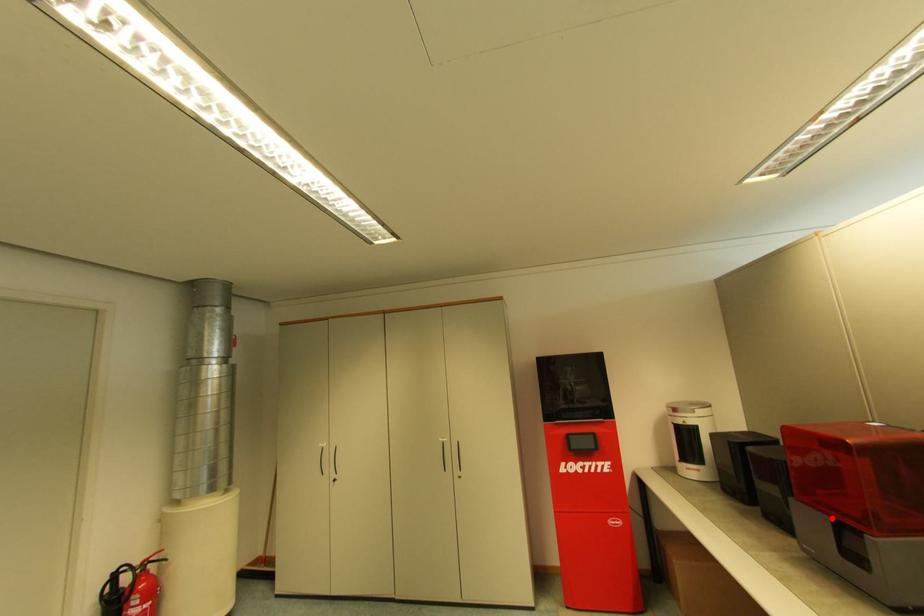
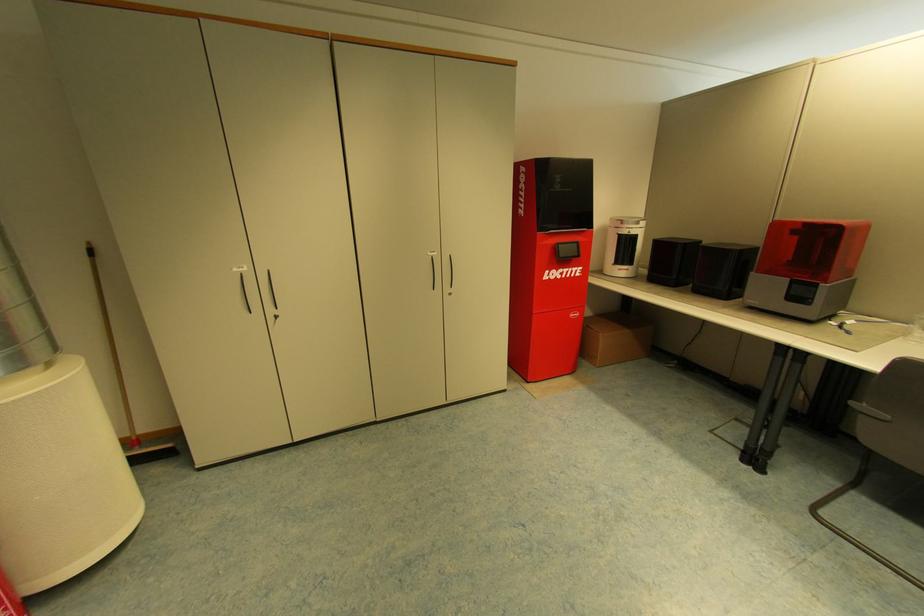
Where in the second image is the point corresponding to the highlighted location from the first image?

(793, 280)